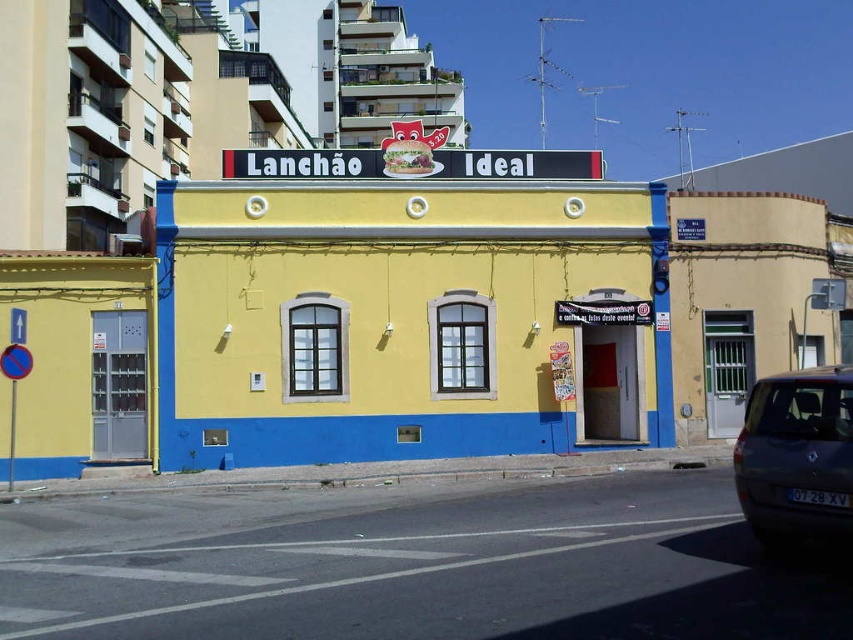
Question: Does yellow matte door at lower left have a greater width compared to dark gray metallic car at lower right?

Choices:
 (A) no
 (B) yes

Answer: (B)

Question: Does yellow matte building at center appear on the right side of dark gray metallic car at lower right?

Choices:
 (A) no
 (B) yes

Answer: (A)

Question: Estimate the real-world distances between objects in this image. Which object is closer to the yellow matte door at lower left?

Choices:
 (A) yellow matte building at center
 (B) dark gray metallic car at lower right

Answer: (A)

Question: Where is yellow matte building at center located in relation to yellow matte door at lower left in the image?

Choices:
 (A) below
 (B) above

Answer: (B)

Question: Which object is the closest to the yellow matte door at lower left?

Choices:
 (A) yellow matte building at center
 (B) dark gray metallic car at lower right

Answer: (A)

Question: Considering the real-world distances, which object is farthest from the yellow matte door at lower left?

Choices:
 (A) yellow matte building at center
 (B) dark gray metallic car at lower right

Answer: (B)